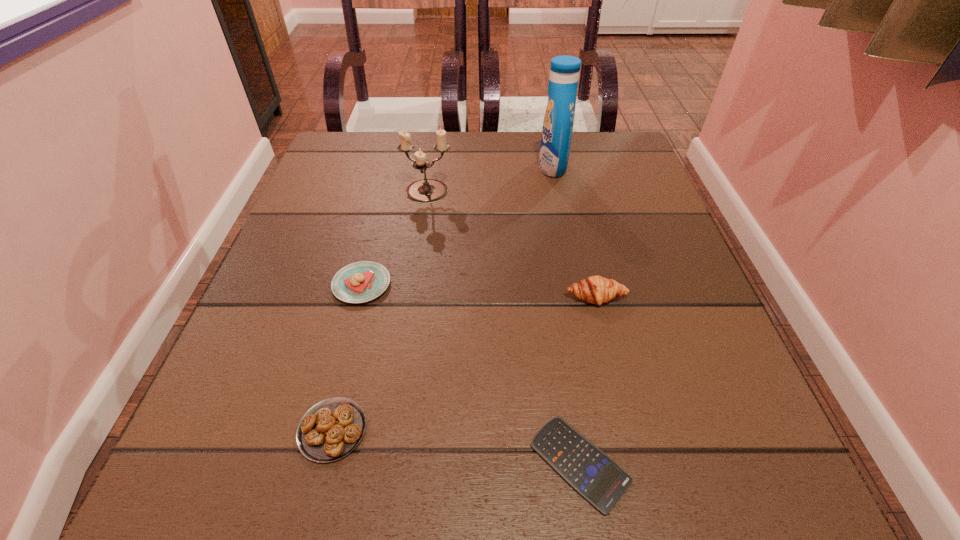
Where is `detergent`? The image size is (960, 540). detergent is located at coordinates (558, 121).

Identify the location of the second tallest object. (424, 191).

At what (x,y) coordinates should I click in order to perform the action: click on the third tallest object. Please return your answer as a coordinate pair (x, y). The height and width of the screenshot is (540, 960). Looking at the image, I should click on (596, 289).

You are a GUI agent. You are given a task and a screenshot of the screen. Output one action in this format:
    pyautogui.click(x=<x>, y=<y>)
    Task: Click on the tallest pastry
    The width and height of the screenshot is (960, 540).
    Given the screenshot: What is the action you would take?
    pyautogui.click(x=596, y=289)

You are a GUI agent. You are given a task and a screenshot of the screen. Output one action in this format:
    pyautogui.click(x=<x>, y=<y>)
    Task: Click on the second shortest pastry
    This screenshot has height=540, width=960.
    Given the screenshot: What is the action you would take?
    pyautogui.click(x=359, y=282)

Identify the location of the nearest pastry. (331, 429).

This screenshot has width=960, height=540. Find the location of `the fifth tallest object`. the fifth tallest object is located at coordinates (331, 429).

Locate an element on the screen. The image size is (960, 540). the shortest object is located at coordinates (595, 476).

The height and width of the screenshot is (540, 960). In order to click on vacant space located on the front-facing side of the detergent in this screenshot , I will do `click(438, 167)`.

Image resolution: width=960 pixels, height=540 pixels. In order to click on free point located on the front-facing side of the detergent in this screenshot , I will do `click(400, 167)`.